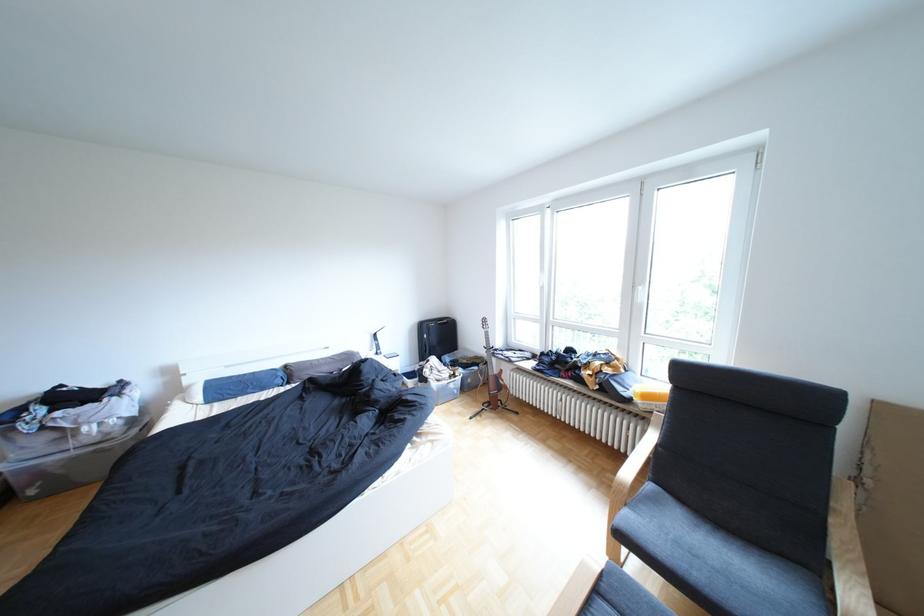
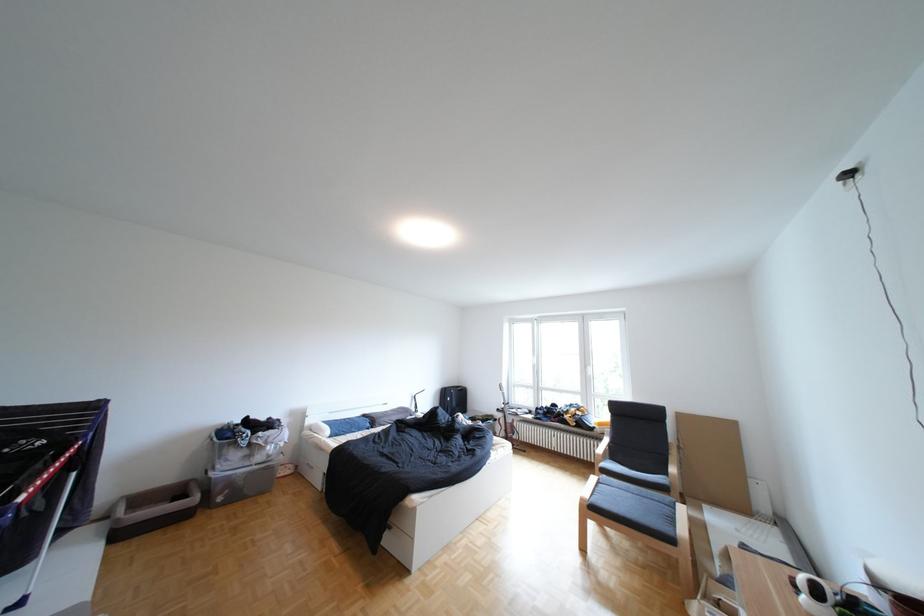
Locate, in the second image, the point that corresponds to [438,328] in the first image.

(459, 392)